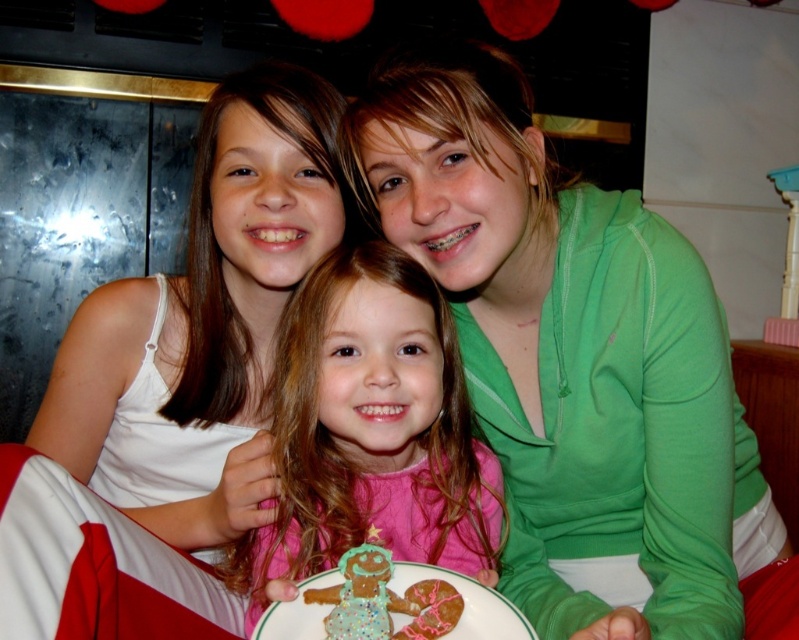
Does green matte sweater at upper right have a greater width compared to glazed sugar cookie at center?

Indeed, green matte sweater at upper right has a greater width compared to glazed sugar cookie at center.

Is green matte sweater at upper right thinner than glazed sugar cookie at center?

No.

Identify the location of green matte sweater at upper right. (203, 323).

The image size is (799, 640). Identify the location of green matte sweater at upper right. (203, 323).

Is green soft hoodie at center above green matte sweater at upper right?

No, green soft hoodie at center is not above green matte sweater at upper right.

Who is more distant from viewer, [426,56] or [237,280]?

Point [237,280]

The width and height of the screenshot is (799, 640). Describe the element at coordinates (571, 356) in the screenshot. I see `green soft hoodie at center` at that location.

The width and height of the screenshot is (799, 640). Identify the location of green soft hoodie at center. (571, 356).

Is green soft hoodie at center to the right of glazed sugar cookie at center from the viewer's perspective?

Correct, you'll find green soft hoodie at center to the right of glazed sugar cookie at center.

Is green soft hoodie at center above glazed sugar cookie at center?

Yes, green soft hoodie at center is above glazed sugar cookie at center.

Describe the element at coordinates (571, 356) in the screenshot. I see `green soft hoodie at center` at that location.

Where is `green soft hoodie at center`? Image resolution: width=799 pixels, height=640 pixels. green soft hoodie at center is located at coordinates (571, 356).